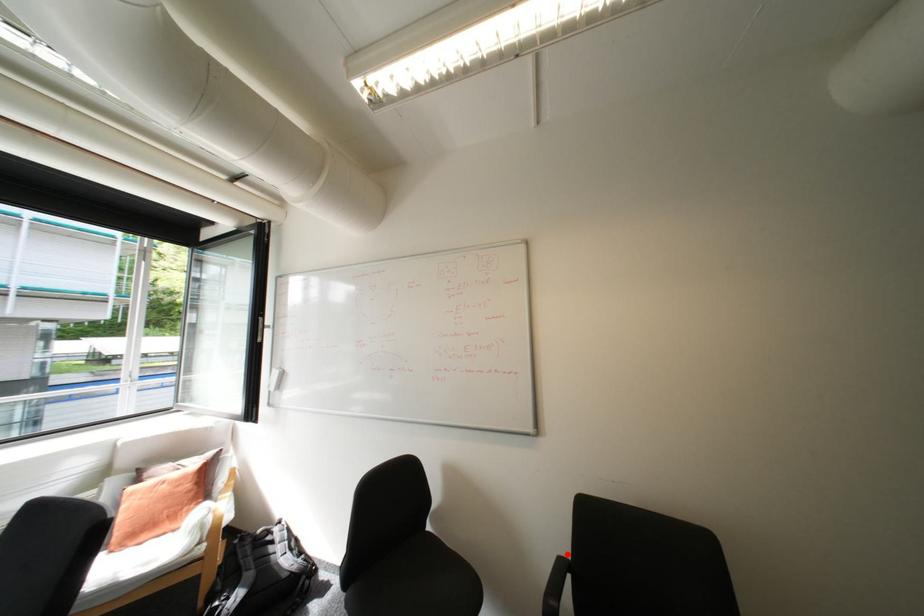
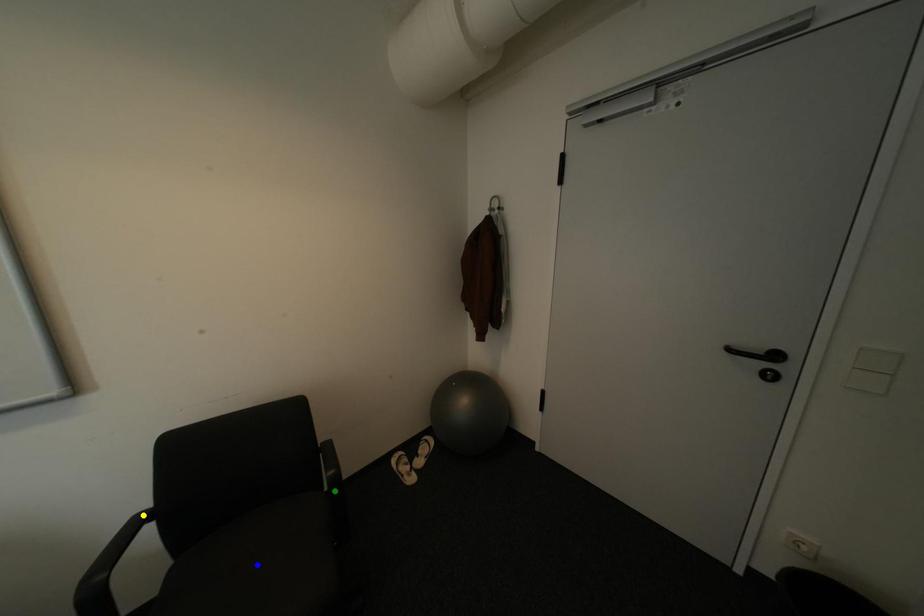
Question: I am providing you with two images of the same scene from different viewpoints. A red point is marked on the first image. You are given multiple points on the second image. Which spot in image 2 lines up with the point in image 1?

Choices:
 (A) green point
 (B) yellow point
 (C) blue point

Answer: (B)